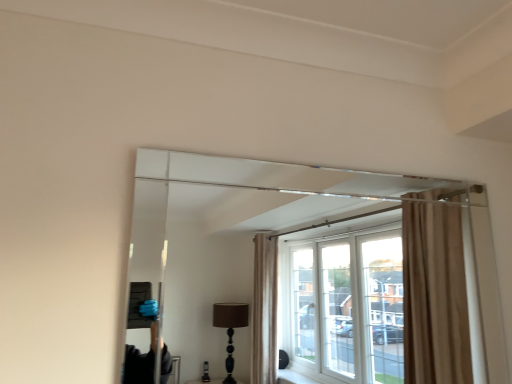
Where is `transparent glass window at center`? The height and width of the screenshot is (384, 512). transparent glass window at center is located at coordinates (305, 261).

This screenshot has height=384, width=512. What do you see at coordinates (305, 261) in the screenshot?
I see `transparent glass window at center` at bounding box center [305, 261].

Measure the distance between transparent glass window at center and camera.

transparent glass window at center and camera are 1.31 meters apart.

Find the location of a particular element. The image size is (512, 384). transparent glass window at center is located at coordinates (305, 261).